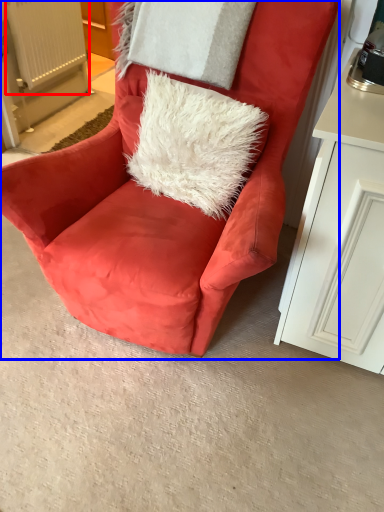
Question: Which point is closer to the camera, radiator (highlighted by a red box) or chair (highlighted by a blue box)?

Choices:
 (A) radiator
 (B) chair

Answer: (B)